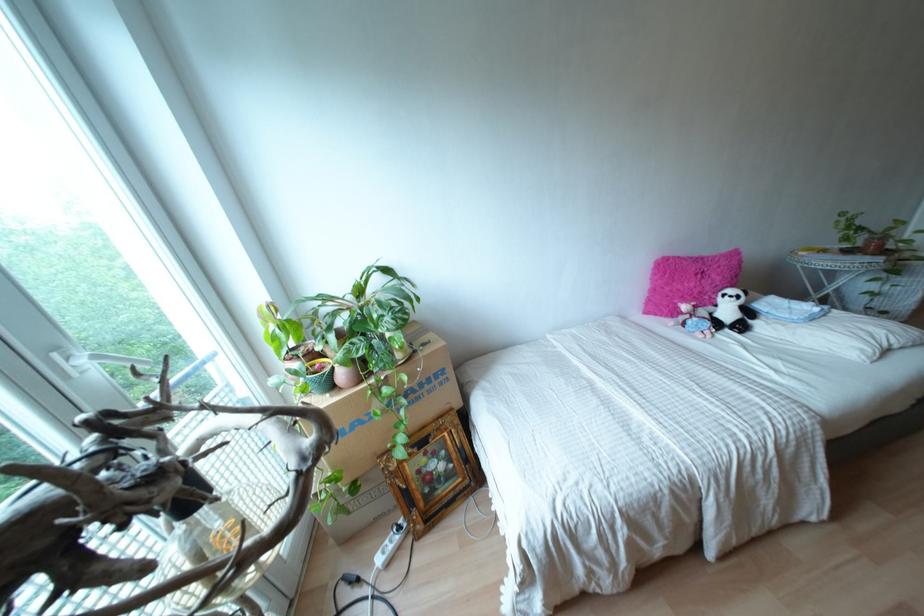
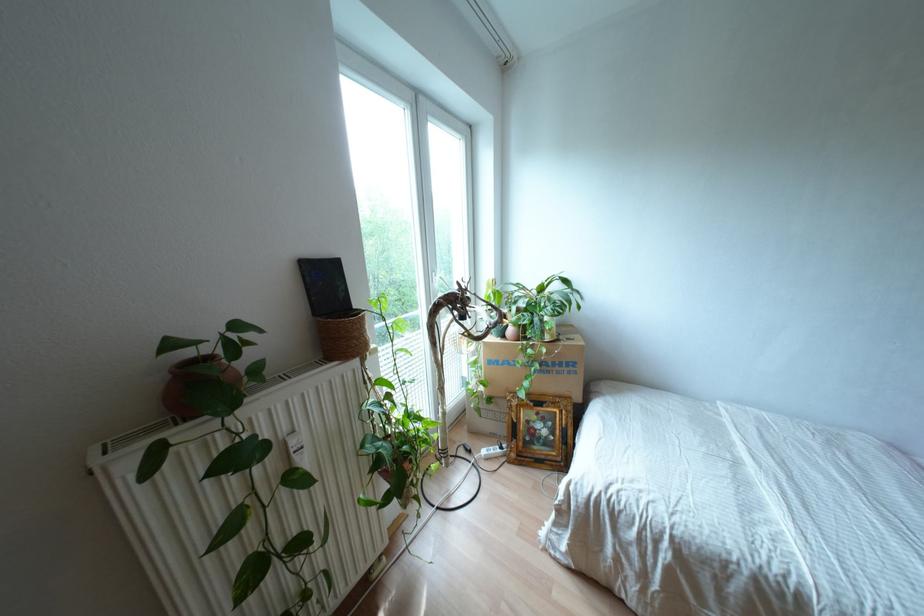
Where in the second image is the point corresponding to point (428, 379) from the first image?

(560, 363)